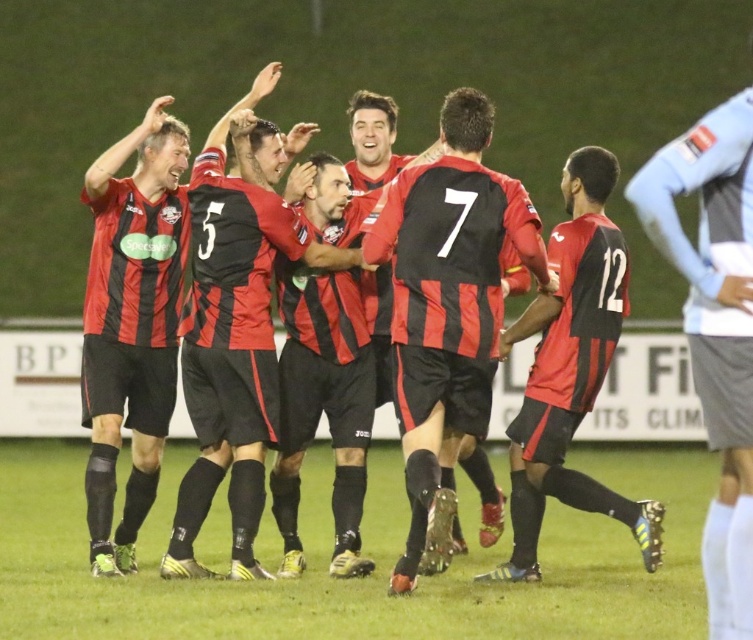
Question: Is matte red and black jersey at center wider than matte black jersey at center?

Choices:
 (A) no
 (B) yes

Answer: (B)

Question: Which point is closer to the camera taking this photo?

Choices:
 (A) (636, 177)
 (B) (145, 298)

Answer: (A)

Question: Estimate the real-world distances between objects in this image. Which object is closer to the matte jersey at center?

Choices:
 (A) light blue jersey at upper right
 (B) matte black jersey at center

Answer: (B)

Question: From the image, what is the correct spatial relationship of matte red and black jersey at center in relation to matte black jersey at center?

Choices:
 (A) below
 (B) above

Answer: (B)

Question: Which object is closer to the camera taking this photo?

Choices:
 (A) matte black jersey at center
 (B) matte jersey at center
 (C) light blue jersey at upper right
 (D) matte red and black jersey at center

Answer: (C)

Question: Can you confirm if matte red and black jersey at center is positioned to the left of light blue jersey at upper right?

Choices:
 (A) no
 (B) yes

Answer: (B)